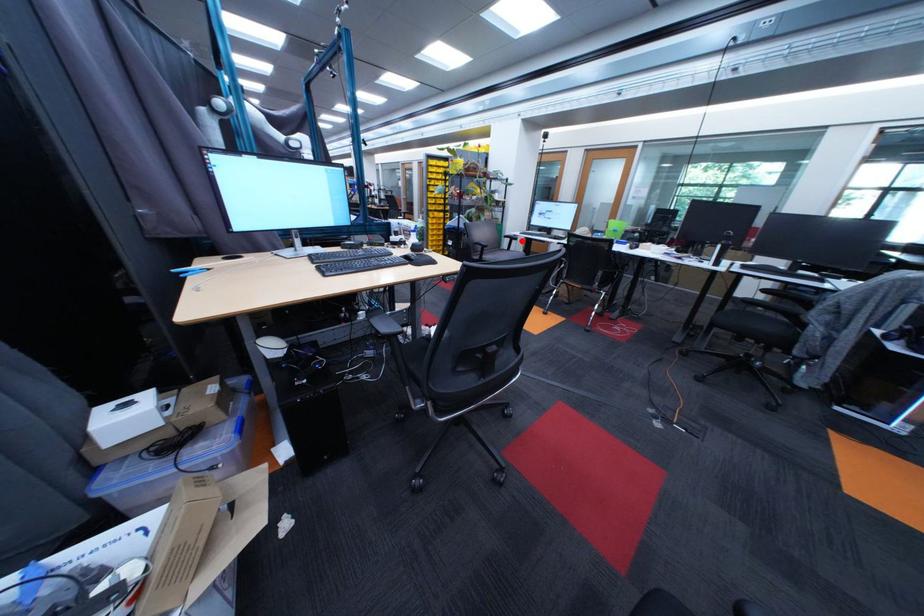
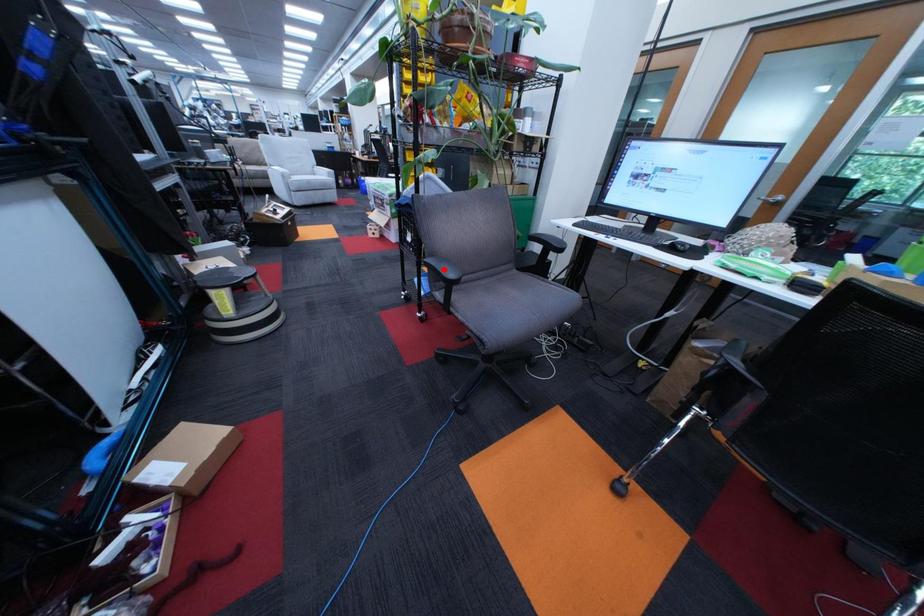
I am providing you with two images of the same scene from different viewpoints. A red point is marked on the first image and another point is marked on the second image. Are the points marked in image1 and image2 representing the same 3D position?

No